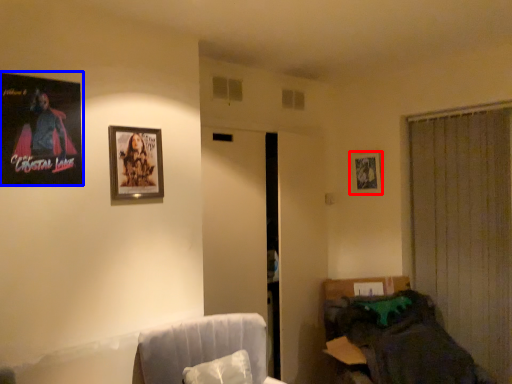
Question: Which of the following is the closest to the observer, picture frame (highlighted by a red box) or picture frame (highlighted by a blue box)?

Choices:
 (A) picture frame
 (B) picture frame

Answer: (B)